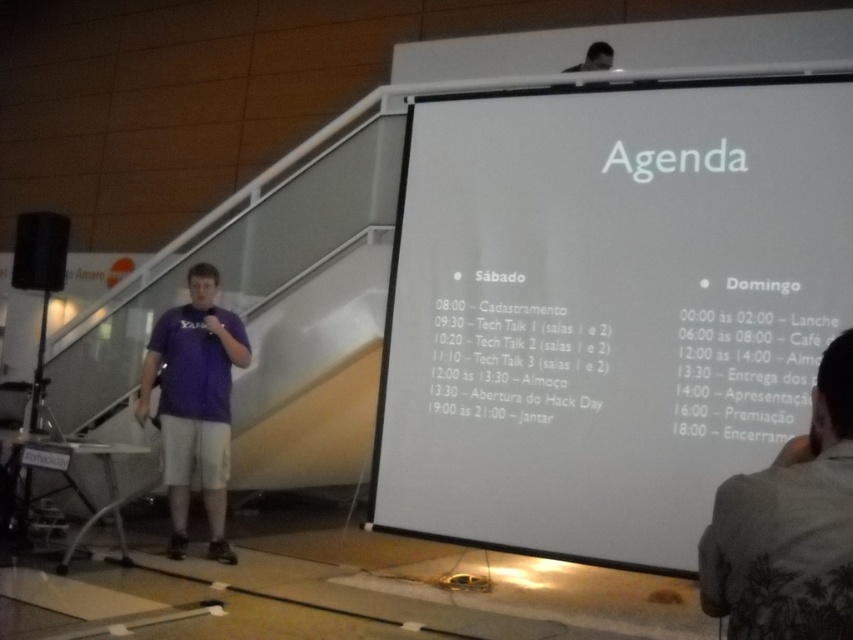
In the scene shown: Can you confirm if gray cotton shirt at lower right is taller than purple fabric shirt at center?

Incorrect, gray cotton shirt at lower right's height is not larger of purple fabric shirt at center's.

How distant is gray cotton shirt at lower right from purple fabric shirt at center?

gray cotton shirt at lower right and purple fabric shirt at center are 3.45 meters apart.

Where is `gray cotton shirt at lower right`? Image resolution: width=853 pixels, height=640 pixels. gray cotton shirt at lower right is located at coordinates (788, 529).

Can you confirm if purple fabric shirt at center is positioned below matte purple shirt at upper center?

Correct, purple fabric shirt at center is located below matte purple shirt at upper center.

Is point (219, 323) positioned after point (596, 58)?

No, (219, 323) is closer to viewer.

The image size is (853, 640). I want to click on purple fabric shirt at center, so click(x=195, y=403).

Does white paper at upper center have a greater height compared to matte purple shirt at upper center?

Yes, white paper at upper center is taller than matte purple shirt at upper center.

Does white paper at upper center appear over matte purple shirt at upper center?

Actually, white paper at upper center is below matte purple shirt at upper center.

What do you see at coordinates (607, 308) in the screenshot? I see `white paper at upper center` at bounding box center [607, 308].

Find the location of `white paper at upper center`. white paper at upper center is located at coordinates (607, 308).